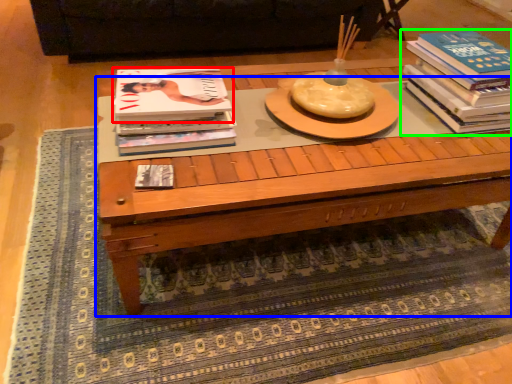
Question: Which object is positioned closest to book (highlighted by a red box)? Select from coffee table (highlighted by a blue box) and book (highlighted by a green box).

Choices:
 (A) coffee table
 (B) book

Answer: (A)